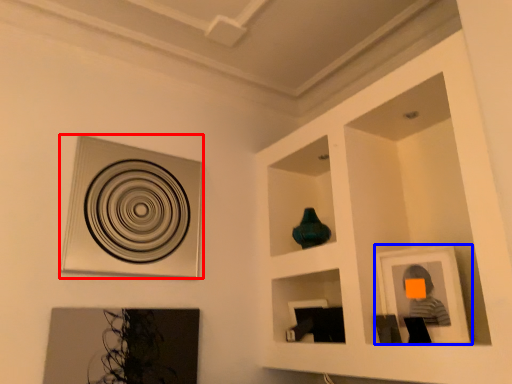
Question: Among these objects, which one is farthest to the camera, picture frame (highlighted by a red box) or picture frame (highlighted by a blue box)?

Choices:
 (A) picture frame
 (B) picture frame

Answer: (A)